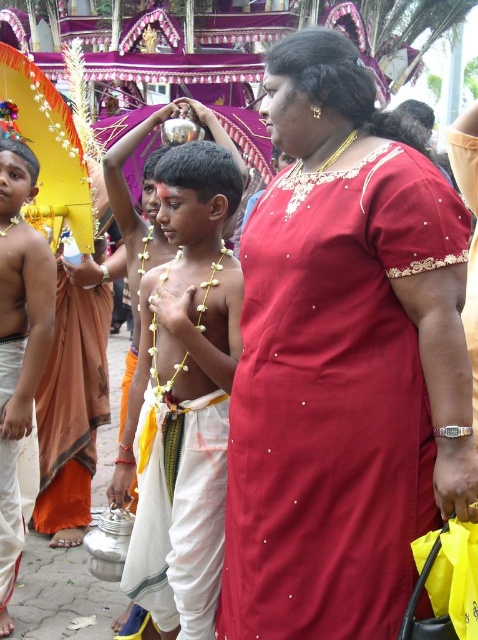
In the scene shown: Who is positioned more to the left, white cotton dhoti at center or white cloth boy at center?

From the viewer's perspective, white cloth boy at center appears more on the left side.

Is white cotton dhoti at center smaller than white cloth boy at center?

Yes.

Is point (171, 445) behind point (9, 464)?

No, it is not.

Find the location of a particular element. This screenshot has width=478, height=640. white cotton dhoti at center is located at coordinates (178, 513).

Is point (46, 413) positioned before point (3, 548)?

No, it is behind (3, 548).

Locate an element on the screen. orange silk sari at left is located at coordinates (72, 406).

Where is `orange silk sari at left`? The image size is (478, 640). orange silk sari at left is located at coordinates (72, 406).

Is point (35, 237) farther from camera compared to point (0, 368)?

Yes, point (35, 237) is farther from viewer.

Does white cloth boy at center have a greater width compared to white cotton robe at lower left?

Indeed, white cloth boy at center has a greater width compared to white cotton robe at lower left.

Is point (11, 280) positioned before point (28, 500)?

That is True.

Where is `white cloth boy at center`? The height and width of the screenshot is (640, 478). white cloth boy at center is located at coordinates (19, 344).